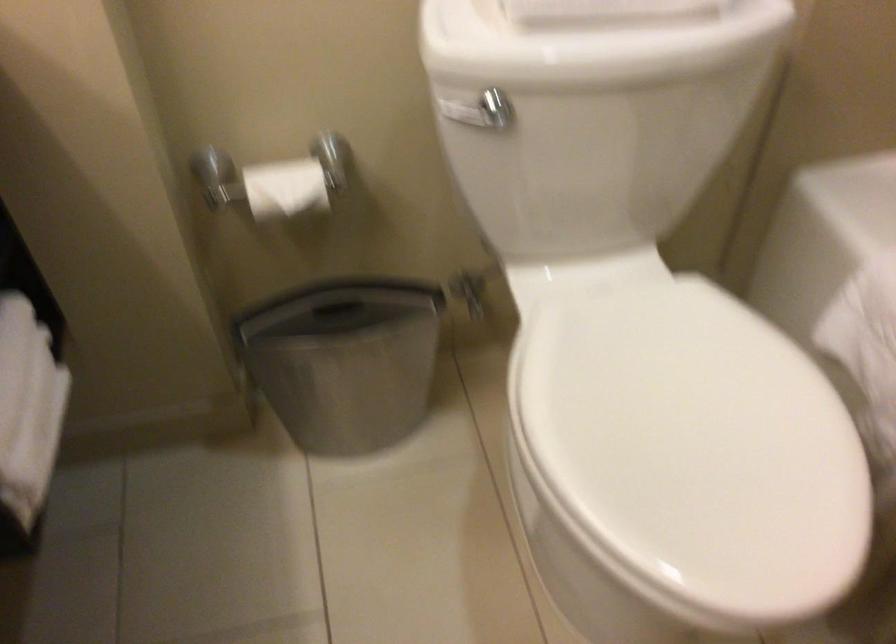
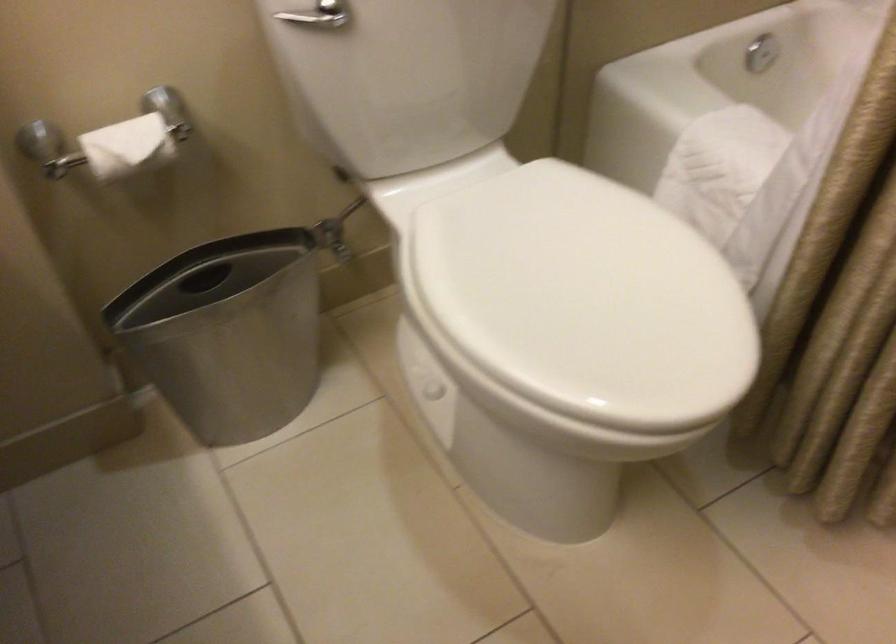
Where in the second image is the point corresponding to (338,374) from the first image?

(228, 333)